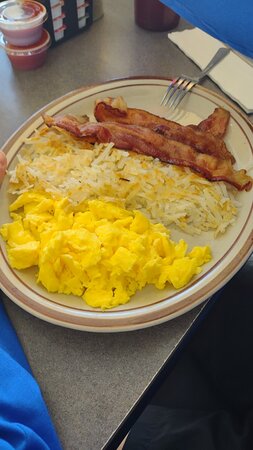
Find the location of `metal fork`. metal fork is located at coordinates (193, 78).